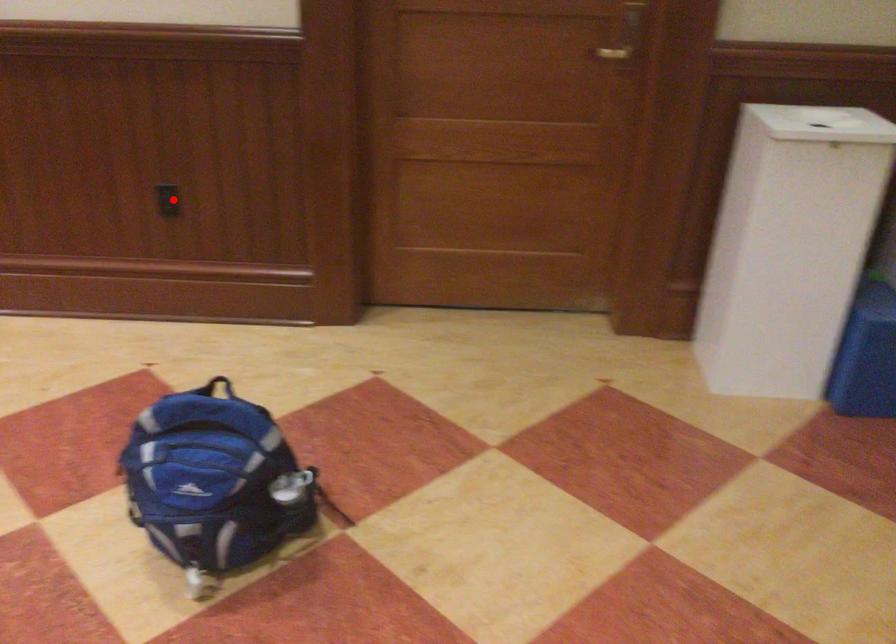
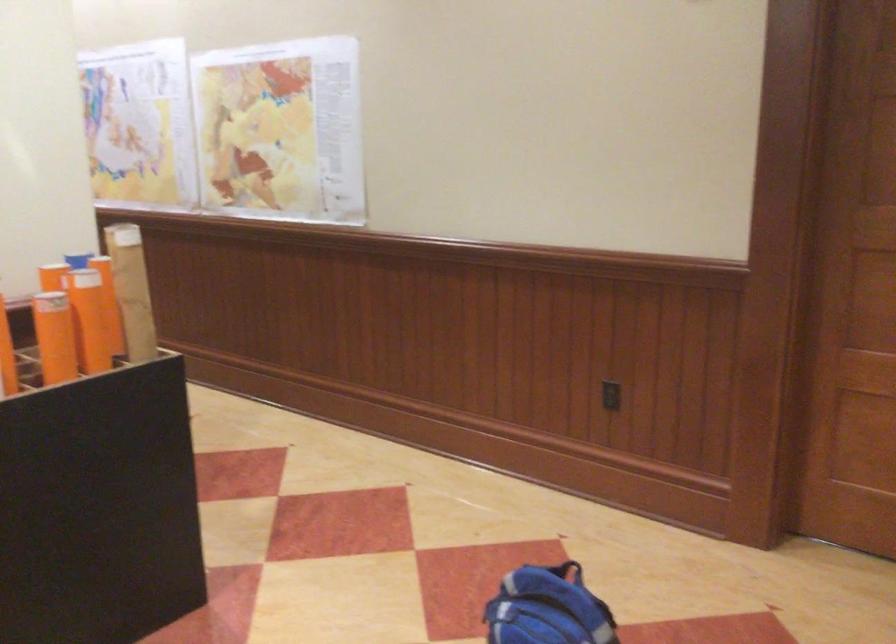
Locate, in the second image, the point that corresponds to the highlighted location in the first image.

(609, 395)